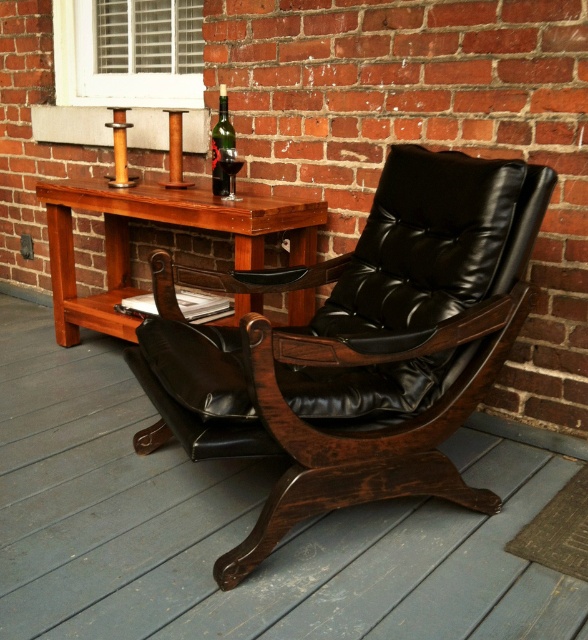
Image resolution: width=588 pixels, height=640 pixels. What do you see at coordinates (238, 525) in the screenshot? I see `dark brown wood chair at center` at bounding box center [238, 525].

Can you confirm if dark brown wood chair at center is taller than black leather chair at center?

No.

Between point (350, 568) and point (432, 301), which one is positioned in front?

Point (350, 568) is in front.

Identify the location of dark brown wood chair at center. The image size is (588, 640). (238, 525).

Who is taller, black leather chair at center or mahogany wood table at center?

With more height is black leather chair at center.

Who is more forward, (218, 404) or (83, 209)?

Point (218, 404) is more forward.

Is point (349, 493) behind point (252, 240)?

No, it is not.

This screenshot has height=640, width=588. I want to click on black leather chair at center, so click(x=360, y=349).

Does point (28, 408) come farther from viewer compared to point (243, 244)?

Yes, it is.

Based on the photo, how far apart are dark brown wood chair at center and mahogany wood table at center?

27.88 inches

Locate an element on the screen. Image resolution: width=588 pixels, height=640 pixels. dark brown wood chair at center is located at coordinates (238, 525).